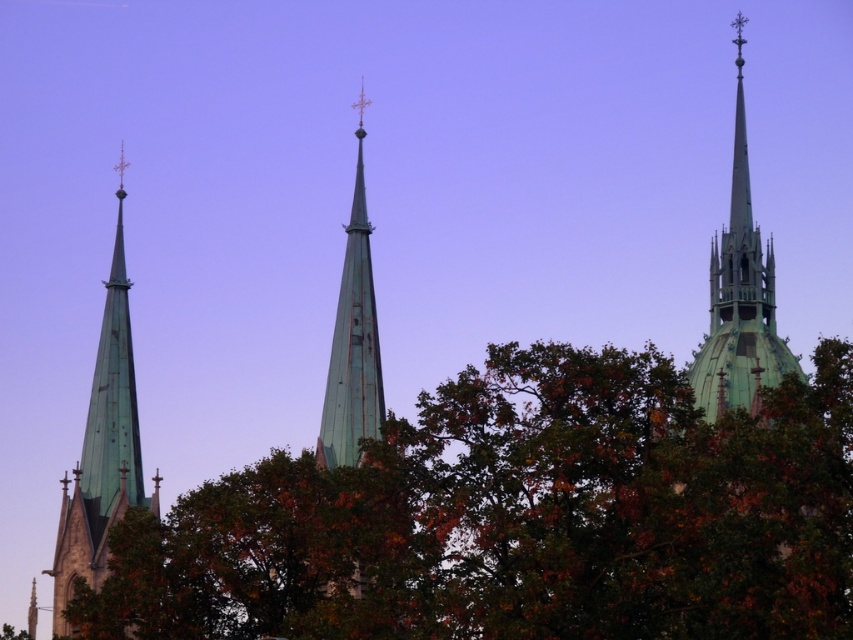
Is green leafy tree at center below green copper spire at upper right?

Correct, green leafy tree at center is located below green copper spire at upper right.

Can you confirm if green leafy tree at center is positioned above green copper spire at upper right?

No.

You are a GUI agent. You are given a task and a screenshot of the screen. Output one action in this format:
    pyautogui.click(x=<x>, y=<y>)
    Task: Click on the green leafy tree at center
    This screenshot has height=640, width=853.
    Given the screenshot: What is the action you would take?
    pyautogui.click(x=520, y=516)

Does green copper spire at left have a lesser width compared to green copper spire at upper right?

In fact, green copper spire at left might be wider than green copper spire at upper right.

Does green copper spire at left have a larger size compared to green copper spire at upper right?

No.

Where is `green copper spire at left`? green copper spire at left is located at coordinates (102, 449).

Measure the distance from green leafy tree at center to green copper spire at left.

green leafy tree at center is 28.19 meters away from green copper spire at left.

Does point (833, 404) lie behind point (99, 371)?

No, it is not.

Is point (625, 628) closer to camera compared to point (155, 497)?

Yes, point (625, 628) is closer to viewer.

Locate an element on the screen. green leafy tree at center is located at coordinates (520, 516).